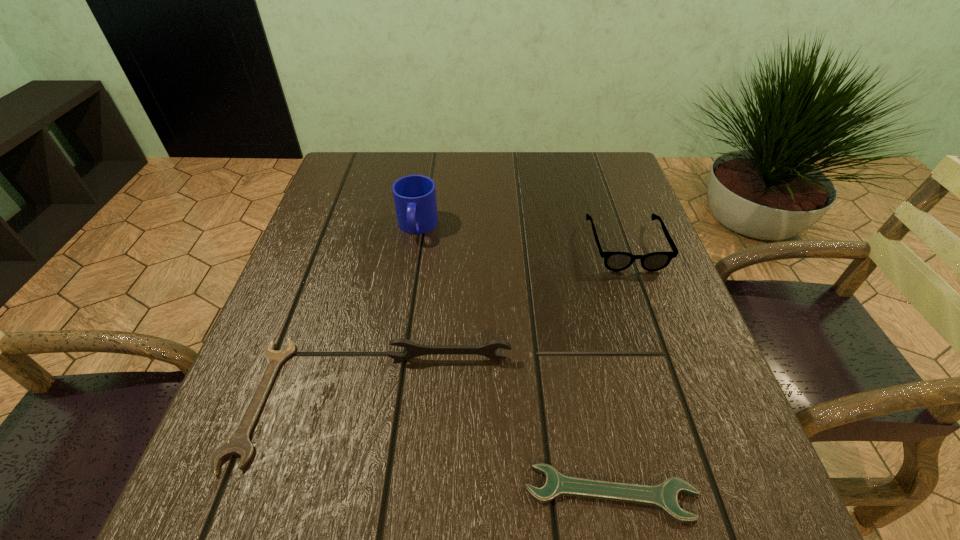
Image resolution: width=960 pixels, height=540 pixels. In order to click on blank region between the rightmost wrench and the mug in this screenshot , I will do `click(514, 360)`.

Locate an element on the screen. The height and width of the screenshot is (540, 960). free spot between the rightmost wrench and the tallest wrench is located at coordinates (530, 426).

I want to click on object that is the fourth closest to the rightmost wrench, so click(414, 196).

You are a GUI agent. You are given a task and a screenshot of the screen. Output one action in this format:
    pyautogui.click(x=<x>, y=<y>)
    Task: Click on the object that is the nearest to the second wrench from right to left
    
    Given the screenshot: What is the action you would take?
    pyautogui.click(x=239, y=443)

Select which wrench appears as the second closest to the rightmost wrench. Please provide its 2D coordinates. Your answer should be formatted as a tuple, i.e. [(x, y)], where the tuple contains the x and y coordinates of a point satisfying the conditions above.

[(239, 443)]

Find the location of a particular element. This screenshot has height=540, width=960. wrench that is the third closest one to the tallest object is located at coordinates (663, 496).